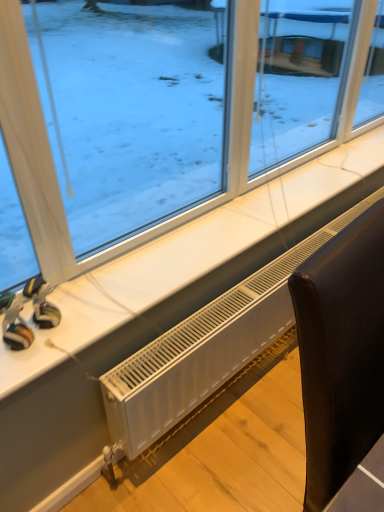
Identify the location of vacant area that lies in front of matte plastic toy at lower left, the 2th toy viewed from the left. The height and width of the screenshot is (512, 384). (37, 356).